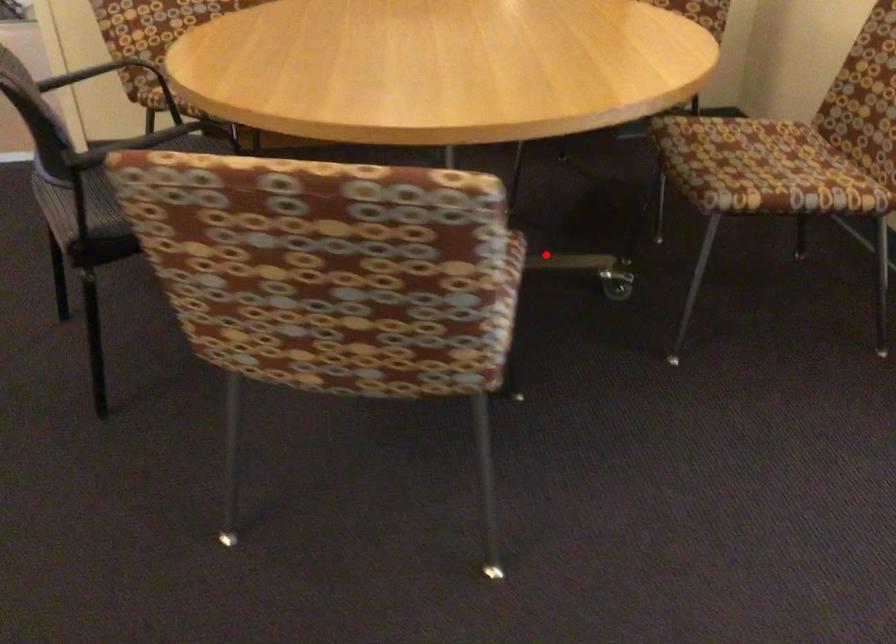
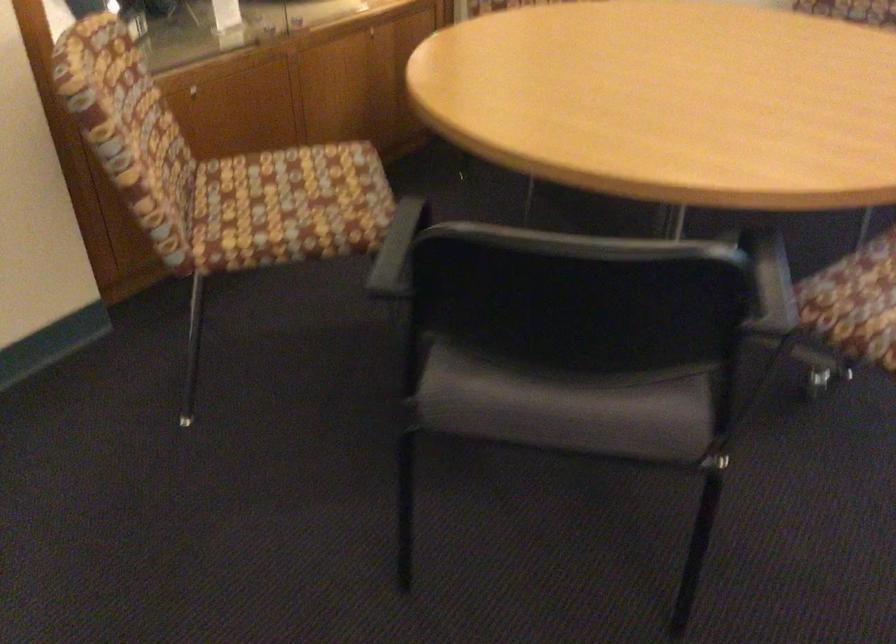
Question: I am providing you with two images of the same scene from different viewpoints. A red point is marked on the first image. Can you still see the location of the red point in image 2?

Choices:
 (A) Yes
 (B) No

Answer: (B)